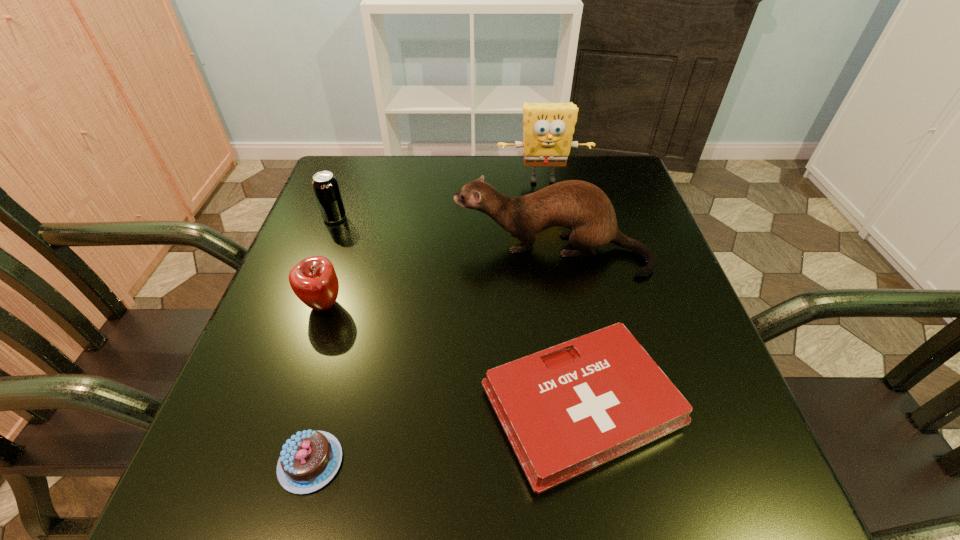
Find the location of a particular element. The height and width of the screenshot is (540, 960). apple that is at the left edge is located at coordinates (314, 281).

Locate an element on the screen. This screenshot has width=960, height=540. chocolate cake situated at the left edge is located at coordinates (310, 459).

At what (x,y) coordinates should I click in order to perform the action: click on sponge at the right edge. Please return your answer as a coordinate pair (x, y). Looking at the image, I should click on (548, 129).

Find the location of `ferret that is at the right edge`. ferret that is at the right edge is located at coordinates (582, 207).

Locate an element on the screen. the first-aid kit that is at the right edge is located at coordinates (568, 409).

Find the location of a particular element. object at the near left corner is located at coordinates (310, 459).

Where is `object that is at the far right corner`? object that is at the far right corner is located at coordinates [x=548, y=129].

Locate an element on the screen. The image size is (960, 540). object present at the near right corner is located at coordinates (568, 409).

Locate an element on the screen. vacant space at the far edge of the desktop is located at coordinates (421, 197).

Image resolution: width=960 pixels, height=540 pixels. Find the location of `vacant point at the near edge`. vacant point at the near edge is located at coordinates (x=616, y=517).